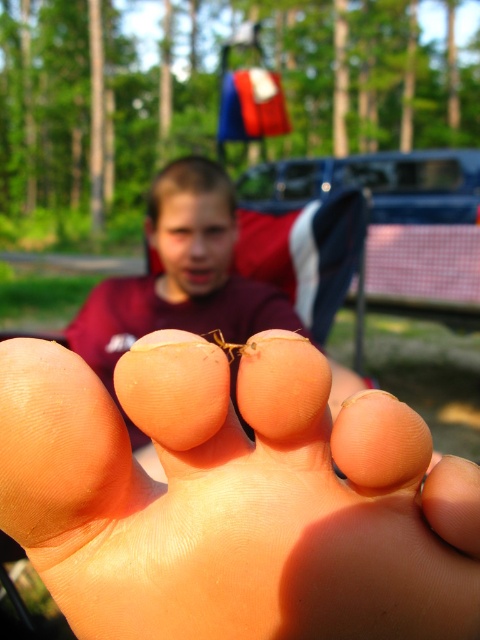
Who is higher up, pink flesh-toned foot at center or matte skin boy at center?

matte skin boy at center is higher up.

This screenshot has height=640, width=480. In order to click on pink flesh-toned foot at center in this screenshot , I will do `click(232, 499)`.

Where is `pink flesh-toned foot at center`? pink flesh-toned foot at center is located at coordinates (232, 499).

Is point (74, 344) in front of point (240, 353)?

No, (74, 344) is further to viewer.

Is matte skin boy at center shorter than yellow translucent ant at center?

No.

What do you see at coordinates (180, 275) in the screenshot? I see `matte skin boy at center` at bounding box center [180, 275].

Locate an element on the screen. This screenshot has height=640, width=480. matte skin boy at center is located at coordinates (180, 275).

Does pink flesh-toned foot at center appear on the right side of yellow translucent ant at center?

Correct, you'll find pink flesh-toned foot at center to the right of yellow translucent ant at center.

Can you confirm if pink flesh-toned foot at center is taller than yellow translucent ant at center?

Indeed, pink flesh-toned foot at center has a greater height compared to yellow translucent ant at center.

Describe the element at coordinates (232, 499) in the screenshot. The image size is (480, 640). I see `pink flesh-toned foot at center` at that location.

Where is `pink flesh-toned foot at center`? This screenshot has width=480, height=640. pink flesh-toned foot at center is located at coordinates (232, 499).